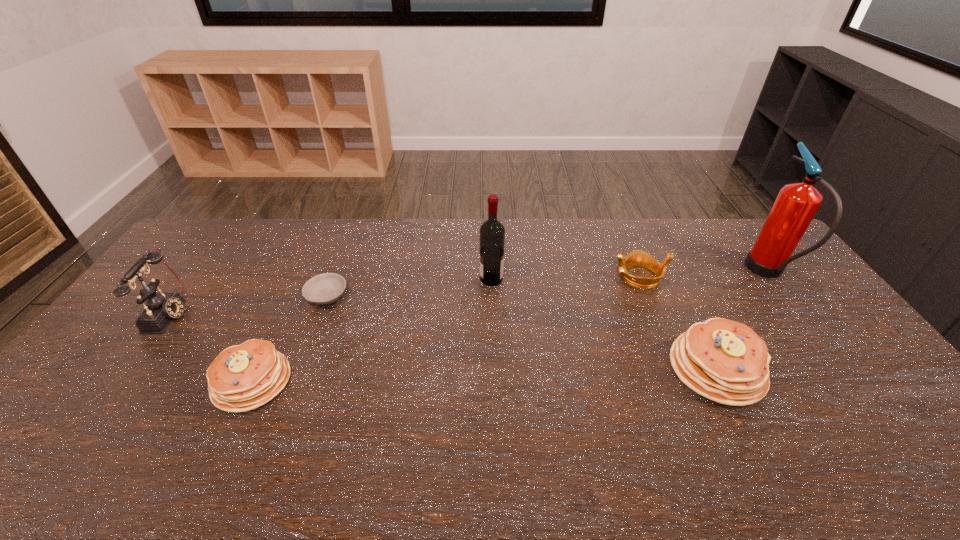
You are a GUI agent. You are given a task and a screenshot of the screen. Output one action in this format:
    pyautogui.click(x=<x>, y=<y>)
    Task: Click on the vacant area between the fourth tallest object and the fourth object from right to left
    This screenshot has height=540, width=960.
    Given the screenshot: What is the action you would take?
    pyautogui.click(x=604, y=324)

Locate an element on the screen. free point between the left pancake and the fire extinguisher is located at coordinates (510, 327).

Identify the location of vacant region between the leftmost object and the tiara. The height and width of the screenshot is (540, 960). (x=405, y=295).

This screenshot has height=540, width=960. Identify the location of vacant space that's between the tiara and the rightmost object. (704, 275).

You are a GUI agent. You are given a task and a screenshot of the screen. Output one action in this format:
    pyautogui.click(x=<x>, y=<y>)
    Task: Click on the free space between the taller pancake and the fire extinguisher
    
    Given the screenshot: What is the action you would take?
    pyautogui.click(x=742, y=321)

Locate an element on the screen. vacant space that's between the fourth tallest object and the telephone is located at coordinates (444, 341).

Locate which object is the third closest to the fourth object from right to left. Please provide its 2D coordinates. Your answer should be formatted as a tuple, i.e. [(x, y)], where the tuple contains the x and y coordinates of a point satisfying the conditions above.

[(725, 361)]

You are a GUI agent. You are given a task and a screenshot of the screen. Output one action in this format:
    pyautogui.click(x=<x>, y=<y>)
    Task: Click on the object that is the closest to the tallest object
    
    Given the screenshot: What is the action you would take?
    pyautogui.click(x=725, y=361)

What are the coordinates of `free space in the image that satisfies the following two spatial constraints: 1. on the dial of the fourth shortest object; 2. on the left side of the leftmost object` in the screenshot? It's located at (129, 369).

The height and width of the screenshot is (540, 960). I want to click on free region that satisfies the following two spatial constraints: 1. on the front and back of the fourth object from right to left; 2. on the front side of the shorter pancake, so click(x=494, y=382).